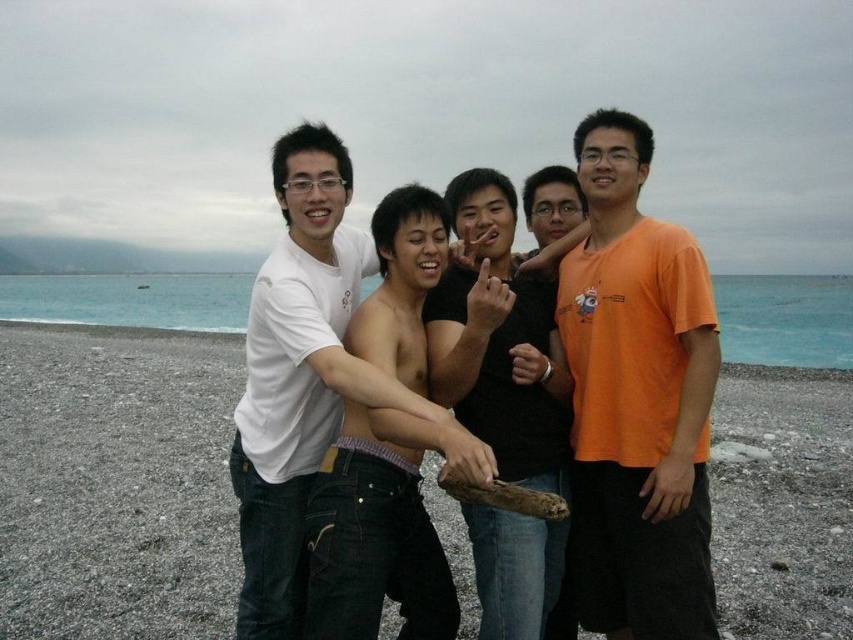
Question: Considering the relative positions of shiny black shirt at center and white cotton shirt at center in the image provided, where is shiny black shirt at center located with respect to white cotton shirt at center?

Choices:
 (A) right
 (B) left

Answer: (A)

Question: Which of the following is the closest to the observer?

Choices:
 (A) (627, 474)
 (B) (523, 326)
 (C) (288, 500)

Answer: (A)

Question: Is smooth sand at center positioned in front of shiny black shirt at center?

Choices:
 (A) yes
 (B) no

Answer: (B)

Question: Can you confirm if shiny black shirt at center is positioned below white cotton shirt at center?

Choices:
 (A) no
 (B) yes

Answer: (B)

Question: Among these points, which one is nearest to the camera?

Choices:
 (A) (341, 266)
 (B) (689, 268)
 (C) (16, 419)
 (D) (457, 381)

Answer: (B)

Question: Which is farther from the orange cotton t-shirt at center?

Choices:
 (A) shiny black shirt at center
 (B) white cotton shirt at center

Answer: (B)